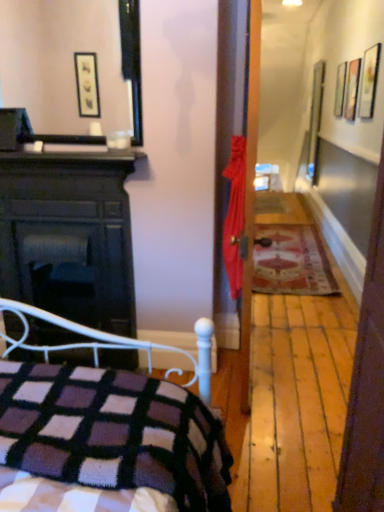
Where is `empty space that is ontop of dark wood fireplace at left (from a real-world perspective)`? empty space that is ontop of dark wood fireplace at left (from a real-world perspective) is located at coordinates (61, 159).